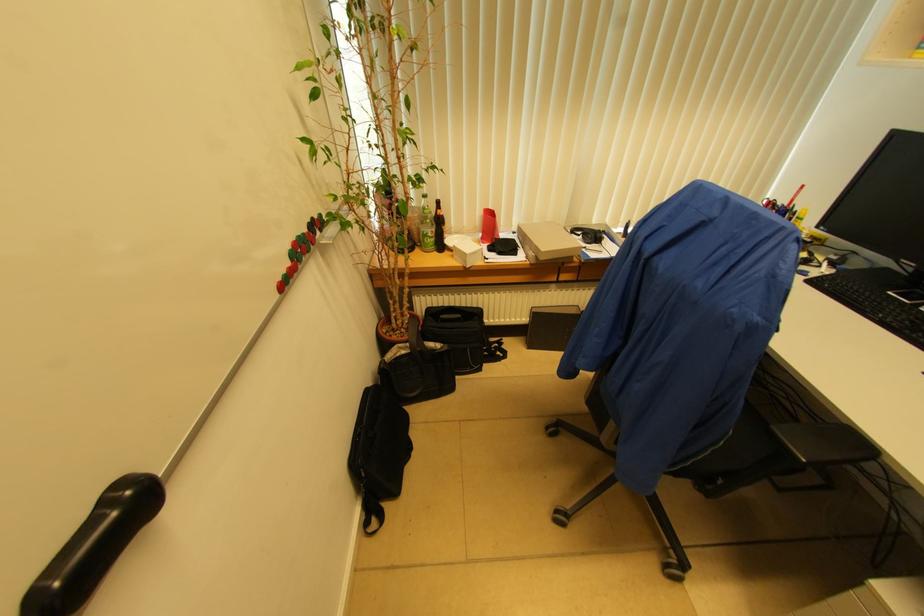
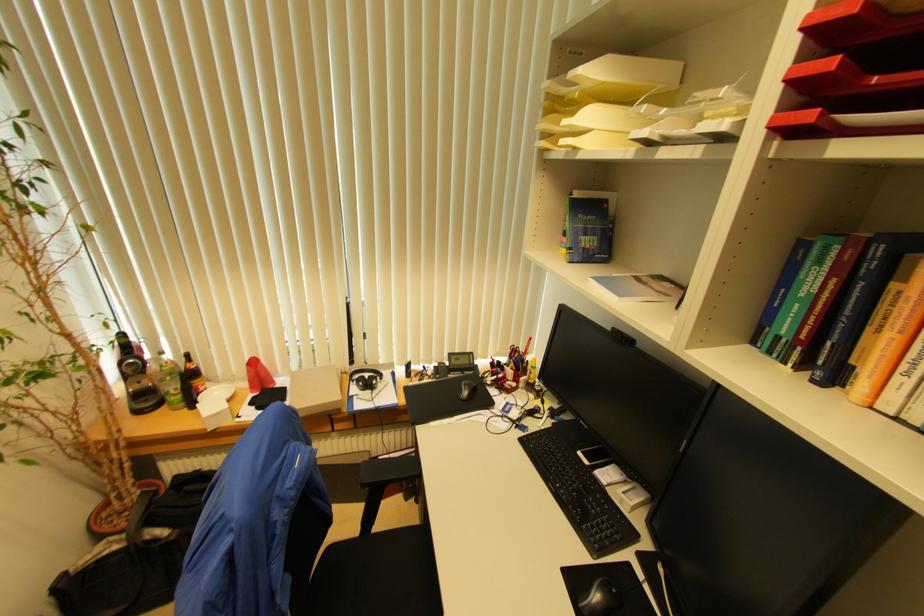
Find the pixel in the second image that matches [440,205] in the first image.

(188, 358)